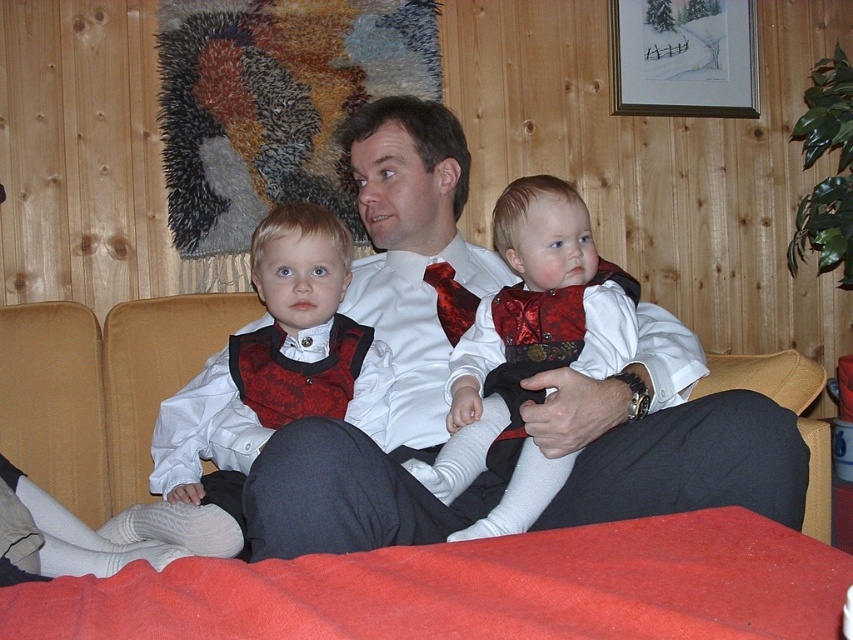
Is matte black vest at left closer to camera compared to matte red vest at center?

No, it is not.

Between matte black vest at left and matte red vest at center, which one has less height?

matte red vest at center

Image resolution: width=853 pixels, height=640 pixels. What do you see at coordinates (271, 371) in the screenshot?
I see `matte black vest at left` at bounding box center [271, 371].

Identify the location of matte black vest at left. This screenshot has width=853, height=640. (271, 371).

Is point (555, 246) more distant than point (463, 289)?

No, (555, 246) is closer to viewer.

Which of these two, matte red vest at center or red satin tie at center, stands taller?

matte red vest at center is taller.

Who is more distant from viewer, (514, 193) or (457, 291)?

Point (457, 291)

The height and width of the screenshot is (640, 853). I want to click on matte red vest at center, so (x=531, y=324).

You are a GUI agent. You are given a task and a screenshot of the screen. Output one action in this format:
    pyautogui.click(x=<x>, y=<y>)
    Task: Click on the white satin shirt at center
    The height and width of the screenshot is (640, 853).
    Given the screenshot: What is the action you would take?
    pyautogui.click(x=389, y=346)

Can you confirm if white satin shirt at center is thinner than red satin tie at center?

No.

Who is more distant from viewer, [433,381] or [445,326]?

The point [445,326] is behind.

This screenshot has width=853, height=640. I want to click on white satin shirt at center, so (x=389, y=346).